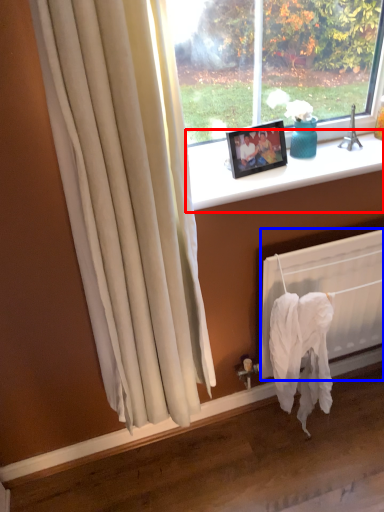
Question: Which object is further to the camera taking this photo, window sill (highlighted by a red box) or radiator (highlighted by a blue box)?

Choices:
 (A) window sill
 (B) radiator

Answer: (B)